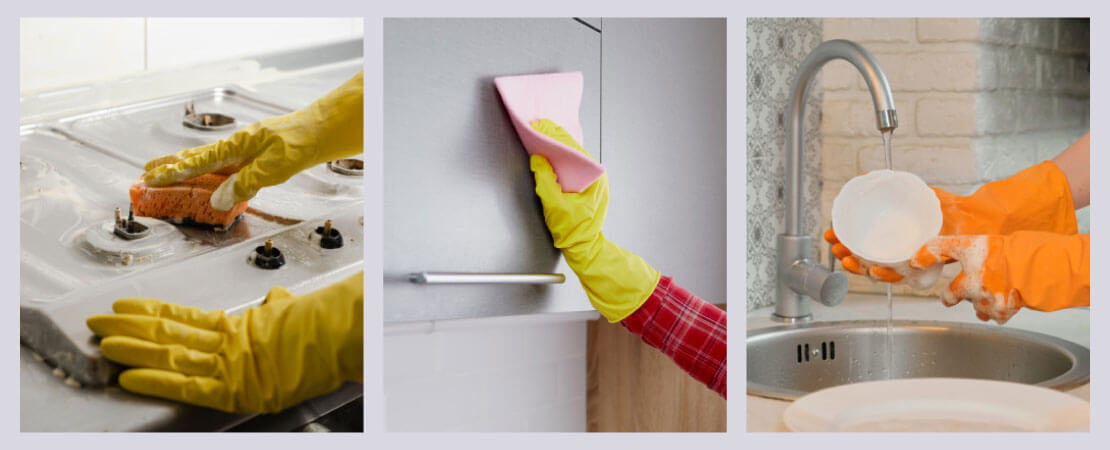
The height and width of the screenshot is (450, 1110). I want to click on orange sponge, so click(x=190, y=201).